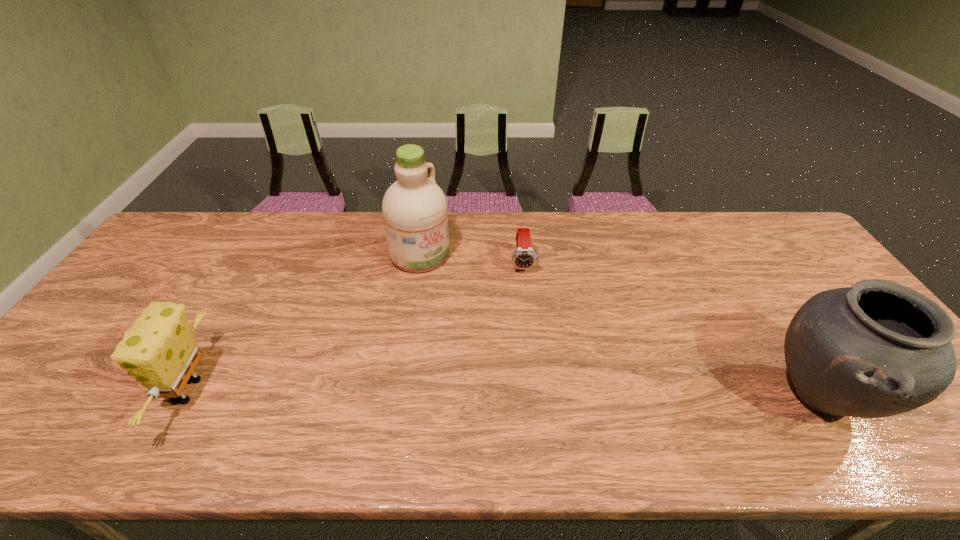
This screenshot has height=540, width=960. What are the coordinates of `free spot on the desktop that is between the leftmost object and the rightmost object and is positioned on the front label of the tallest object` in the screenshot? It's located at (597, 394).

The image size is (960, 540). I want to click on vacant space on the desktop that is between the sponge and the urn and is positioned on the face of the shortest object, so coord(536,394).